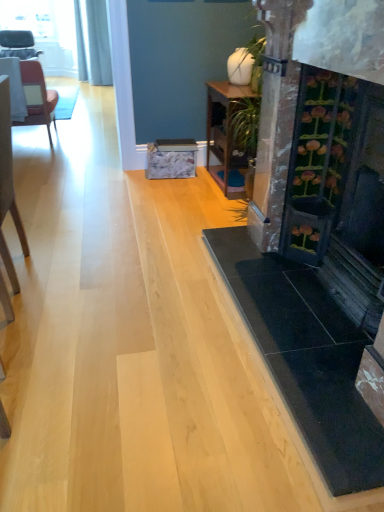
Question: Can matte brown chair at left, arranged as the second chair when viewed from the top, be found inside wooden table at center, which is the first table in right-to-left order?

Choices:
 (A) no
 (B) yes

Answer: (A)

Question: Is wooden table at center, which is the second table in left-to-right order, completely or partially outside of matte brown chair at left, placed as the second chair when sorted from left to right?

Choices:
 (A) no
 (B) yes

Answer: (B)

Question: Is wooden table at center, marked as the second table in a top-to-bottom arrangement, facing away from matte brown chair at left, placed as the second chair when sorted from left to right?

Choices:
 (A) no
 (B) yes

Answer: (A)

Question: Does wooden table at center, which is the second table in left-to-right order, have a lesser width compared to matte brown chair at left, positioned as the 2th chair in bottom-to-top order?

Choices:
 (A) no
 (B) yes

Answer: (B)

Question: Considering the relative positions of wooden table at center, the 1th table from the front, and matte brown chair at left, the 2th chair from the front, in the image provided, is wooden table at center, the 1th table from the front, behind matte brown chair at left, the 2th chair from the front,?

Choices:
 (A) yes
 (B) no

Answer: (B)

Question: Is wooden table at center, acting as the 1th table starting from the bottom, shorter than matte brown chair at left, the 2th chair from the front?

Choices:
 (A) no
 (B) yes

Answer: (B)

Question: Does dark wood fireplace at right have a larger size compared to wooden table at center, which is the second table in left-to-right order?

Choices:
 (A) yes
 (B) no

Answer: (A)

Question: Considering the relative positions of dark wood fireplace at right and wooden table at center, the 1th table from the front, in the image provided, is dark wood fireplace at right behind wooden table at center, the 1th table from the front,?

Choices:
 (A) yes
 (B) no

Answer: (B)

Question: Is dark wood fireplace at right aimed at wooden table at center, acting as the 1th table starting from the bottom?

Choices:
 (A) no
 (B) yes

Answer: (A)

Question: Considering the relative sizes of dark wood fireplace at right and wooden table at center, which is the second table in left-to-right order, in the image provided, is dark wood fireplace at right wider than wooden table at center, which is the second table in left-to-right order,?

Choices:
 (A) no
 (B) yes

Answer: (B)

Question: Is dark wood fireplace at right to the right of wooden table at center, acting as the 2th table starting from the back, from the viewer's perspective?

Choices:
 (A) no
 (B) yes

Answer: (B)

Question: Can you confirm if dark wood fireplace at right is positioned to the left of wooden table at center, the 1th table from the front?

Choices:
 (A) yes
 (B) no

Answer: (B)

Question: From the image's perspective, does white fabric table at left, which is counted as the 1th table, starting from the back, appear lower than matte brown chair at left, which ranks as the 2th chair in back-to-front order?

Choices:
 (A) yes
 (B) no

Answer: (A)